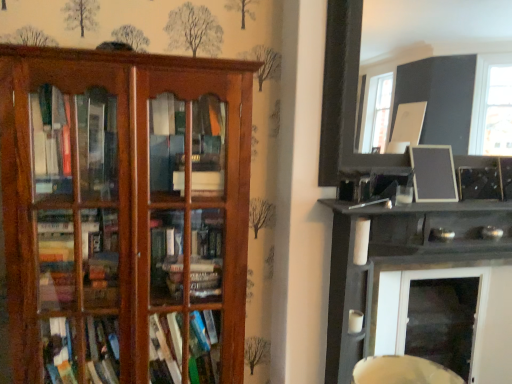
Question: Do you think wooden bookshelf at left, which is the 1th shelf in left-to-right order, is within matte black picture frame at upper right, the 1th picture frame viewed from the top, or outside of it?

Choices:
 (A) inside
 (B) outside

Answer: (B)

Question: Relative to matte black picture frame at upper right, acting as the 2th picture frame starting from the bottom, is wooden bookshelf at left, which is the 1th shelf in left-to-right order, in front or behind?

Choices:
 (A) behind
 (B) front

Answer: (B)

Question: Estimate the real-world distances between objects in this image. Which object is farther from the matte black picture frame at upper right, acting as the 2th picture frame starting from the bottom?

Choices:
 (A) wooden bookshelf at left, the 2th shelf when ordered from right to left
 (B) black glossy shelf at upper right, which appears as the second shelf when viewed from the left
 (C) black matte picture frame at upper right, which appears as the second picture frame when viewed from the top

Answer: (C)

Question: Which object is the farthest from the black matte picture frame at upper right, which appears as the second picture frame when viewed from the top?

Choices:
 (A) matte black picture frame at upper right, the 1th picture frame viewed from the top
 (B) black glossy shelf at upper right, which appears as the second shelf when viewed from the left
 (C) wooden bookshelf at left, which is the 1th shelf in left-to-right order

Answer: (A)